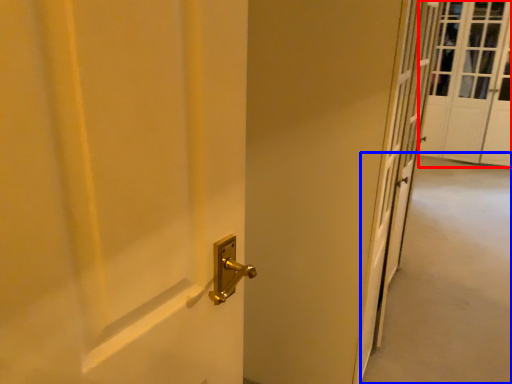
Question: Among these objects, which one is nearest to the camera, screen door (highlighted by a red box) or corridor (highlighted by a blue box)?

Choices:
 (A) screen door
 (B) corridor

Answer: (B)